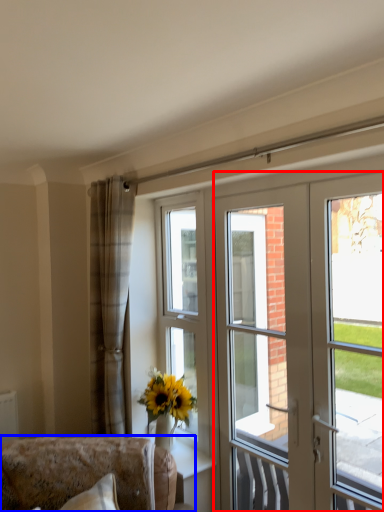
Question: Which object is closer to the camera taking this photo, door (highlighted by a red box) or furniture (highlighted by a blue box)?

Choices:
 (A) door
 (B) furniture

Answer: (A)